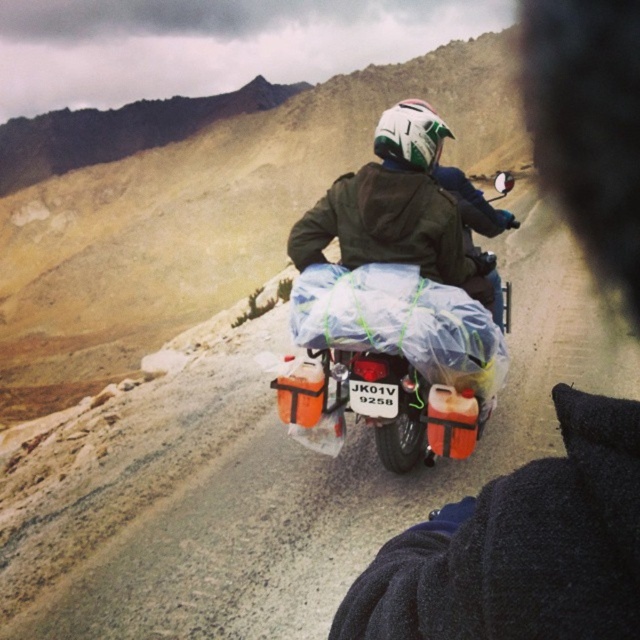
You are a photographer aiming to capture the motorcyclist in the scene. You want to position yourself such that the matte black jacket at center and the matte orange plastic motorcycle at center are both clearly visible in your shot. Based on their positions, which side of the motorcycle should you stand on to ensure both objects are in frame?

You should stand on the left side of the matte orange plastic motorcycle at center because the matte black jacket at center is positioned to the right of the motorcycle, so standing left allows both objects to be visible in the frame.

You are navigating a motorcycle through a mountainous area and need to place two markers on your route. The first marker is at point (604, 561) and the second at point (374, 348). From your perspective, which marker is closer to your current position?

Point (604, 561) is in front of point (374, 348), so the marker at point (604, 561) is closer to your current position.